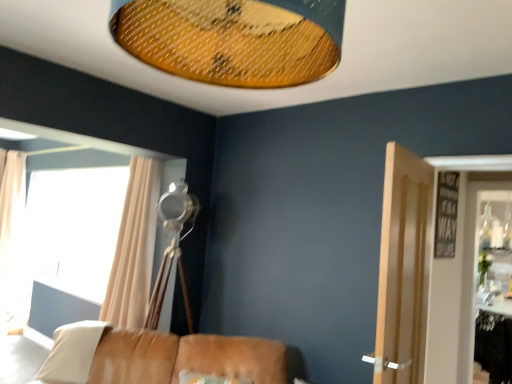
Question: Is beige fabric curtain at left, arranged as the first curtain when viewed from the right, shorter than beige fabric curtain at left, which is the 2th curtain from front to back?

Choices:
 (A) yes
 (B) no

Answer: (A)

Question: Could you tell me if beige fabric curtain at left, marked as the first curtain in a front-to-back arrangement, is turned towards beige fabric curtain at left, which ranks as the first curtain in left-to-right order?

Choices:
 (A) yes
 (B) no

Answer: (B)

Question: Considering the relative sizes of beige fabric curtain at left, which appears as the 2th curtain when viewed from the left, and beige fabric curtain at left, which is the 2th curtain from front to back, in the image provided, is beige fabric curtain at left, which appears as the 2th curtain when viewed from the left, taller than beige fabric curtain at left, which is the 2th curtain from front to back,?

Choices:
 (A) yes
 (B) no

Answer: (B)

Question: Does beige fabric curtain at left, which appears as the 2th curtain when viewed from the left, appear on the left side of beige fabric curtain at left, which appears as the 1th curtain when viewed from the back?

Choices:
 (A) yes
 (B) no

Answer: (B)

Question: From a real-world perspective, is beige fabric curtain at left, marked as the first curtain in a front-to-back arrangement, under beige fabric curtain at left, which appears as the 1th curtain when viewed from the back?

Choices:
 (A) no
 (B) yes

Answer: (A)

Question: Considering their positions, is light brown wooden door at right located in front of or behind white fabric pillow at lower left?

Choices:
 (A) behind
 (B) front

Answer: (B)

Question: Does point click(419, 332) appear closer or farther from the camera than point click(87, 365)?

Choices:
 (A) closer
 (B) farther

Answer: (A)

Question: From a real-world perspective, is light brown wooden door at right physically located above or below white fabric pillow at lower left?

Choices:
 (A) below
 (B) above

Answer: (B)

Question: In terms of height, does light brown wooden door at right look taller or shorter compared to white fabric pillow at lower left?

Choices:
 (A) short
 (B) tall

Answer: (B)

Question: Considering the positions of point (141, 211) and point (14, 203), is point (141, 211) closer or farther from the camera than point (14, 203)?

Choices:
 (A) closer
 (B) farther

Answer: (A)

Question: In terms of size, does beige fabric curtain at left, arranged as the second curtain when viewed from the back, appear bigger or smaller than beige fabric curtain at left, which ranks as the first curtain in left-to-right order?

Choices:
 (A) big
 (B) small

Answer: (A)

Question: From a real-world perspective, is beige fabric curtain at left, arranged as the first curtain when viewed from the right, positioned above or below beige fabric curtain at left, which ranks as the first curtain in left-to-right order?

Choices:
 (A) above
 (B) below

Answer: (A)

Question: Is beige fabric curtain at left, which appears as the 2th curtain when viewed from the left, to the left or to the right of beige fabric curtain at left, arranged as the 2th curtain when viewed from the right, in the image?

Choices:
 (A) left
 (B) right

Answer: (B)

Question: From a real-world perspective, relative to light brown wooden door at right, is white fabric pillow at lower left vertically above or below?

Choices:
 (A) above
 (B) below

Answer: (B)

Question: In terms of width, does white fabric pillow at lower left look wider or thinner when compared to light brown wooden door at right?

Choices:
 (A) wide
 (B) thin

Answer: (A)